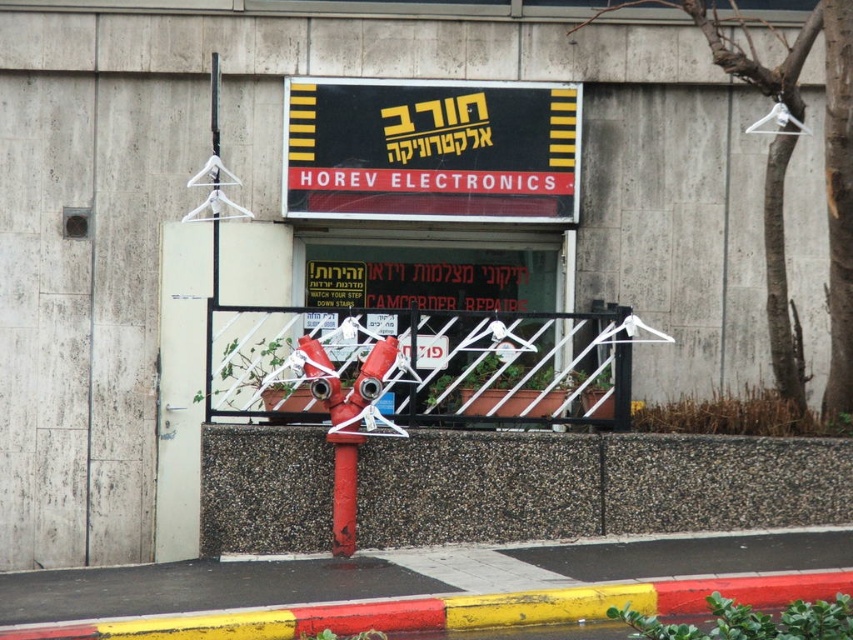
Question: Is red concrete barrier at lower center to the left of yellow rubber curb at lower center from the viewer's perspective?

Choices:
 (A) yes
 (B) no

Answer: (B)

Question: Can you confirm if black plastic sign at center is positioned to the left of yellow rubber curb at lower center?

Choices:
 (A) yes
 (B) no

Answer: (A)

Question: Is red concrete barrier at lower center positioned in front of black plastic sign at center?

Choices:
 (A) no
 (B) yes

Answer: (B)

Question: Which of the following is the closest to the observer?

Choices:
 (A) metallic gate at center
 (B) red matte fire hydrant at center
 (C) yellow rubber curb at lower center
 (D) red concrete barrier at lower center

Answer: (C)

Question: Considering the real-world distances, which object is closest to the red concrete barrier at lower center?

Choices:
 (A) metallic gate at center
 (B) yellow rubber curb at lower center

Answer: (A)

Question: Which of these objects is positioned farthest from the yellow rubber curb at lower center?

Choices:
 (A) red concrete barrier at lower center
 (B) red matte fire hydrant at center

Answer: (A)